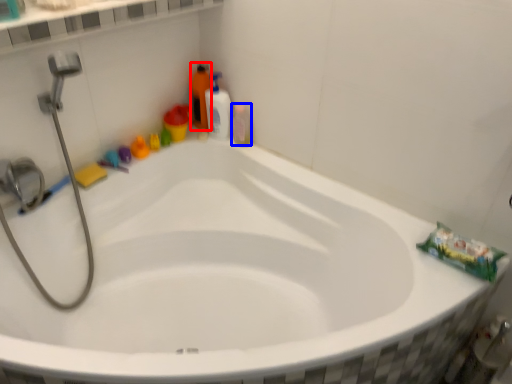
Question: Which object appears closest to the camera in this image, cleaning product (highlighted by a red box) or mouthwash (highlighted by a blue box)?

Choices:
 (A) cleaning product
 (B) mouthwash

Answer: (B)